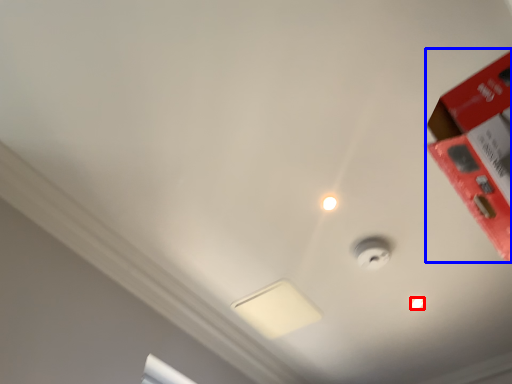
Question: Which point is further to the camera, light bulb (highlighted by a red box) or box (highlighted by a blue box)?

Choices:
 (A) light bulb
 (B) box

Answer: (A)